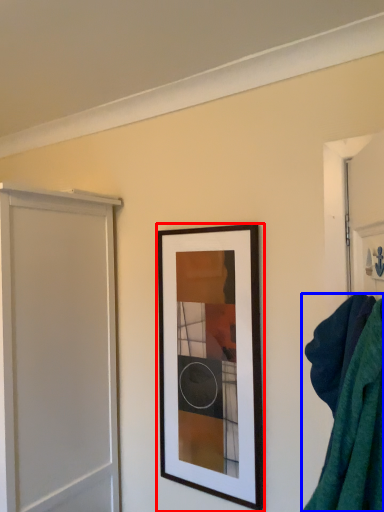
Question: Which point is closer to the camera, picture frame (highlighted by a red box) or bath towel (highlighted by a blue box)?

Choices:
 (A) picture frame
 (B) bath towel

Answer: (B)